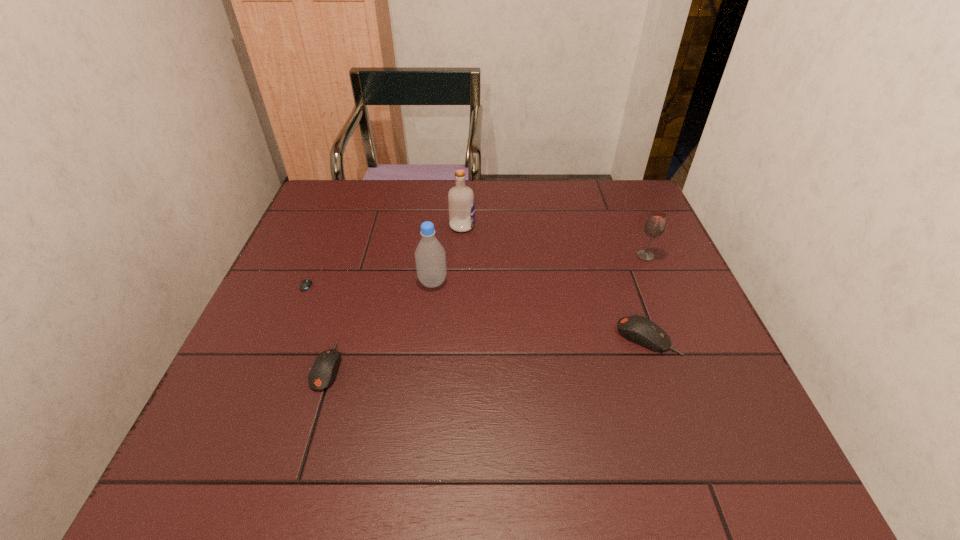
Please determine a free point for an extra mouse_(computer_equipment) to ensure balance. Please provide its 2D coordinates. Your answer should be formatted as a tuple, i.e. [(x, y)], where the tuple contains the x and y coordinates of a point satisfying the conditions above.

[(492, 351)]